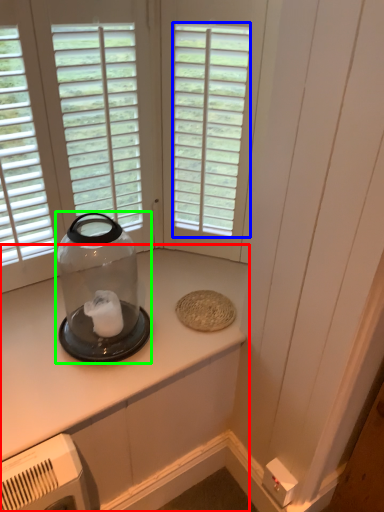
Question: Which object is positioned closest to countertop (highlighted by a red box)? Select from window (highlighted by a blue box) and glass bottle (highlighted by a green box).

Choices:
 (A) window
 (B) glass bottle

Answer: (B)